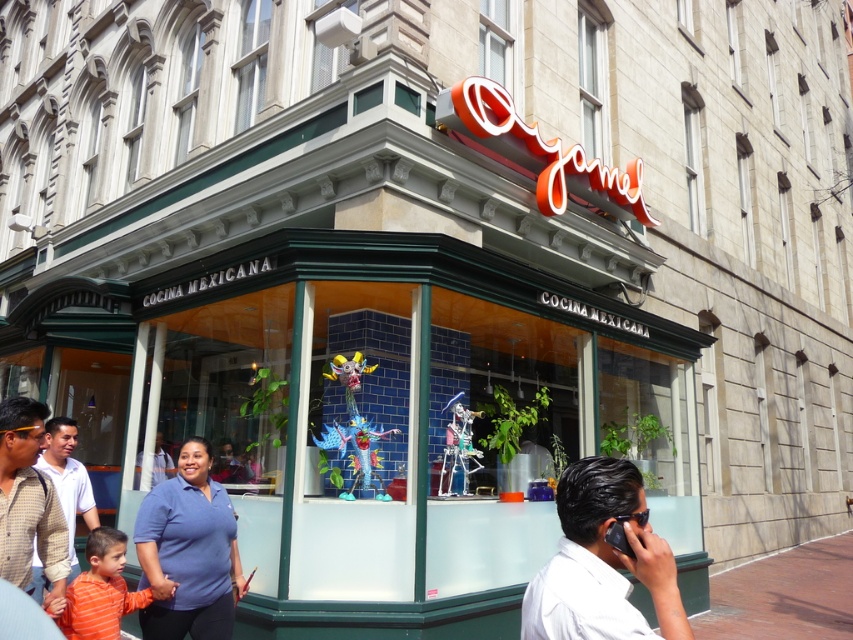
Question: Estimate the real-world distances between objects in this image. Which object is closer to the checkered fabric shirt at lower left?

Choices:
 (A) orange striped shirt at lower left
 (B) blue fabric shirt at lower left
 (C) white shirt at center
 (D) white matte shirt at center

Answer: (A)

Question: Can you confirm if white matte shirt at center is wider than white shirt at center?

Choices:
 (A) yes
 (B) no

Answer: (B)

Question: Observing the image, what is the correct spatial positioning of brick pavement at lower right in reference to orange striped shirt at lower left?

Choices:
 (A) left
 (B) right

Answer: (B)

Question: Among these objects, which one is farthest from the camera?

Choices:
 (A) white shirt at center
 (B) brick pavement at lower right
 (C) white matte shirt at center
 (D) orange striped shirt at lower left

Answer: (B)

Question: Among these objects, which one is nearest to the camera?

Choices:
 (A) orange striped shirt at lower left
 (B) checkered fabric shirt at lower left

Answer: (B)

Question: From the image, what is the correct spatial relationship of brick pavement at lower right in relation to orange striped shirt at lower left?

Choices:
 (A) below
 (B) above

Answer: (A)